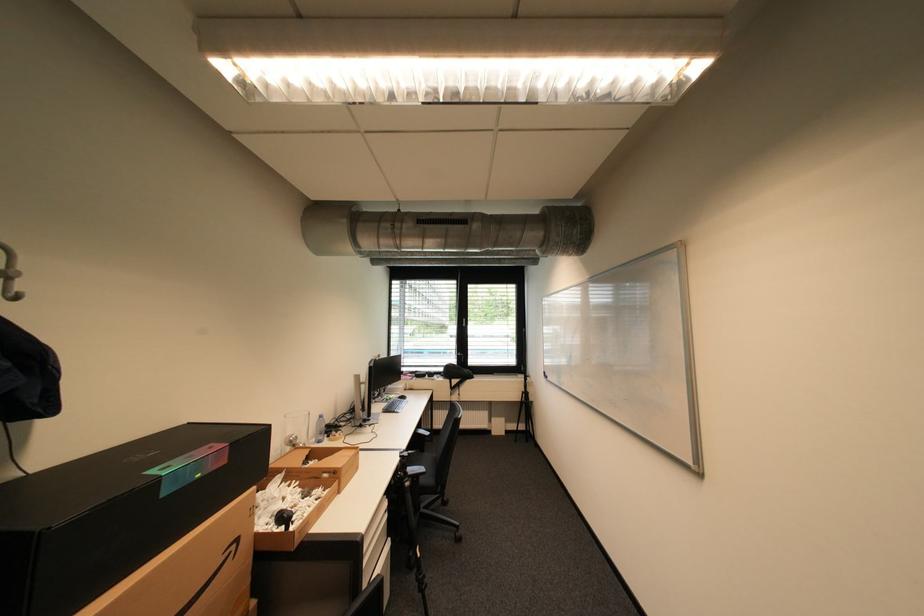
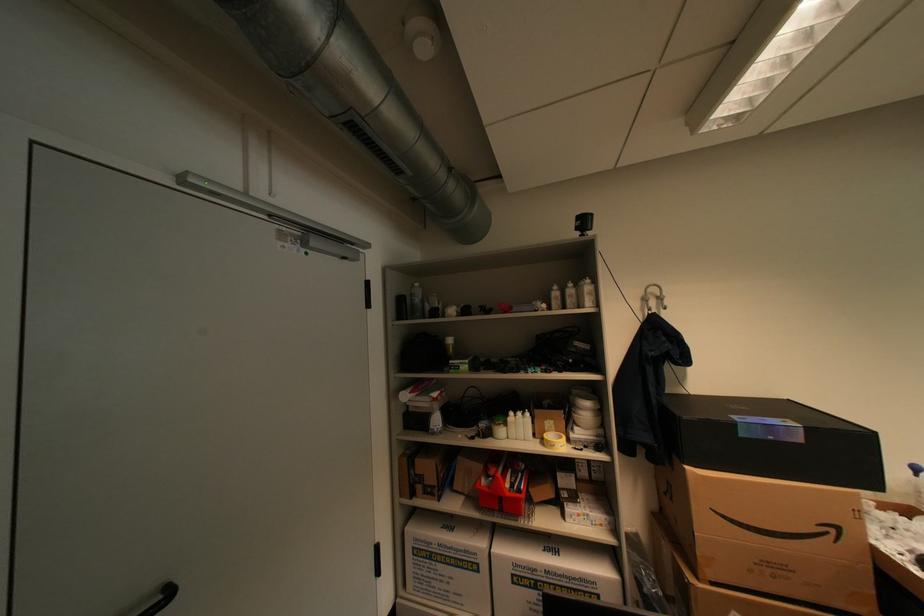
Where in the second image is the point corresponding to point 233,462 from the first image?

(808, 440)